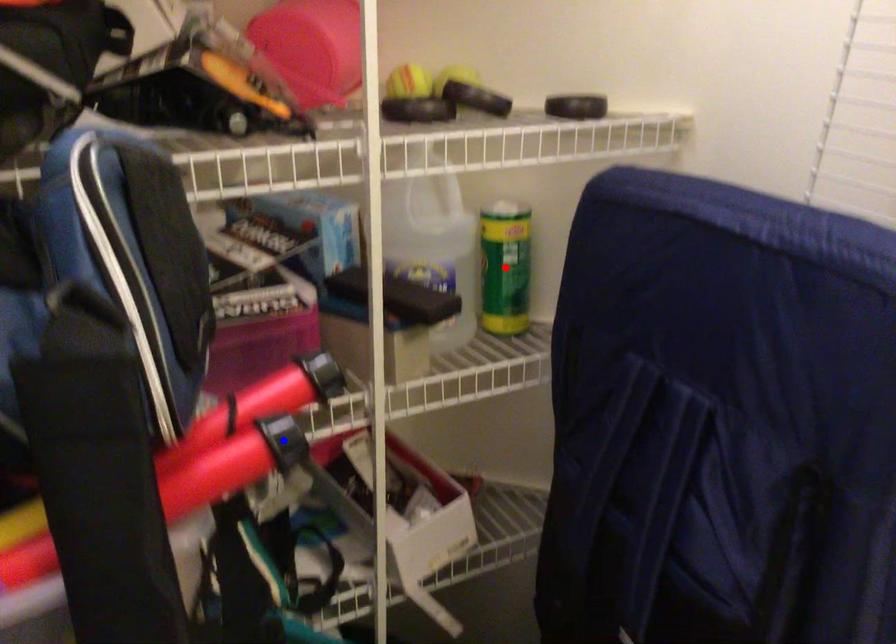
Question: Two points are marked on the image. Which point is closer to the camera?

Choices:
 (A) Blue point is closer.
 (B) Red point is closer.

Answer: (A)